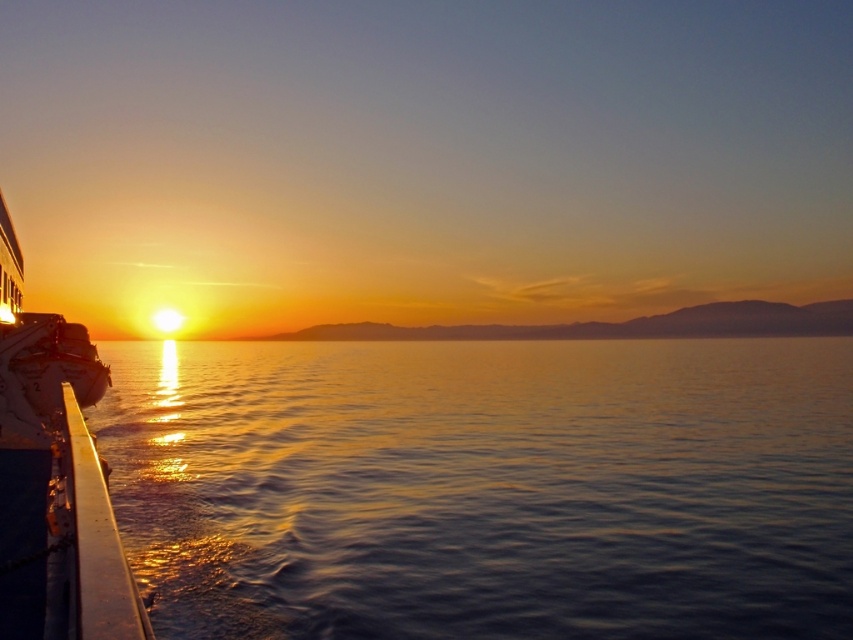
You are standing on the deck of the ship and looking towards the horizon. You see the glistening water at left and the shiny silver boat at left. Which object is closer to the horizon?

The shiny silver boat at left is closer to the horizon because the glistening water at left is below it, meaning the boat is positioned higher up towards the horizon.

You are standing on the deck of the ship and looking towards the horizon. Which object, the glistening water at left or the shiny silver boat at left, appears closer to you based on their height in the image?

The glistening water at left appears closer to you because it is not as tall as the shiny silver boat at left, which suggests it is farther away.